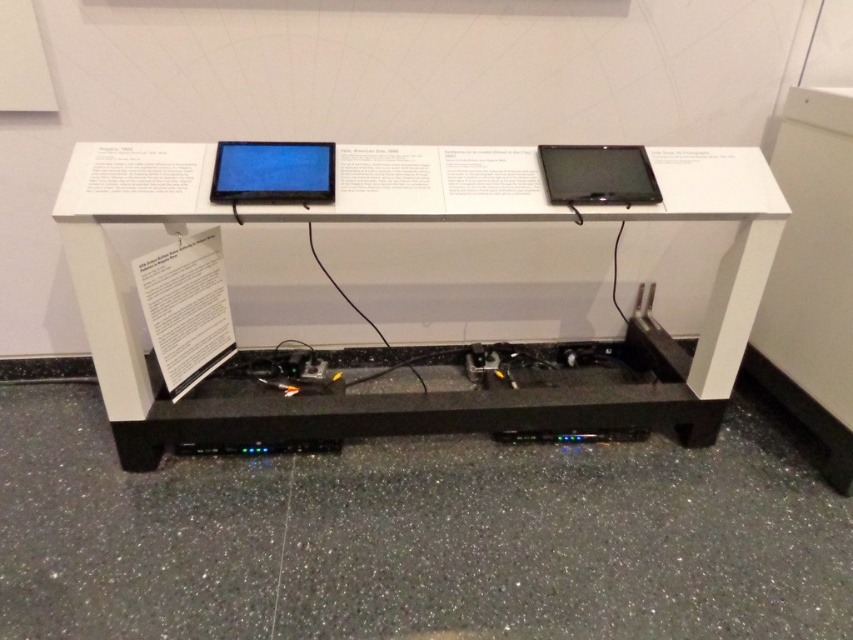
Does white matte table at center lie behind matte black laptop at upper right?

No, white matte table at center is in front of matte black laptop at upper right.

Who is more forward, (694, 445) or (619, 193)?

Positioned in front is point (619, 193).

At what (x,y) coordinates should I click in order to perform the action: click on white matte table at center. Please return your answer as a coordinate pair (x, y). Image resolution: width=853 pixels, height=640 pixels. Looking at the image, I should click on (413, 220).

Is point (299, 195) in front of point (624, 156)?

Yes, point (299, 195) is closer to viewer.

This screenshot has height=640, width=853. What do you see at coordinates (273, 172) in the screenshot?
I see `matte black laptop at center` at bounding box center [273, 172].

The width and height of the screenshot is (853, 640). Describe the element at coordinates (273, 172) in the screenshot. I see `matte black laptop at center` at that location.

You are a GUI agent. You are given a task and a screenshot of the screen. Output one action in this format:
    pyautogui.click(x=<x>, y=<y>)
    Task: Click on the matte black laptop at center
    This screenshot has width=853, height=640.
    Given the screenshot: What is the action you would take?
    pyautogui.click(x=273, y=172)

Does white matte table at center appear under matte black laptop at center?

Indeed, white matte table at center is positioned under matte black laptop at center.

Is white matte table at center in front of matte black laptop at center?

Yes.

Who is more forward, (x=122, y=189) or (x=286, y=163)?

Point (x=122, y=189) is in front.

Identify the location of white matte table at center. This screenshot has height=640, width=853. (413, 220).